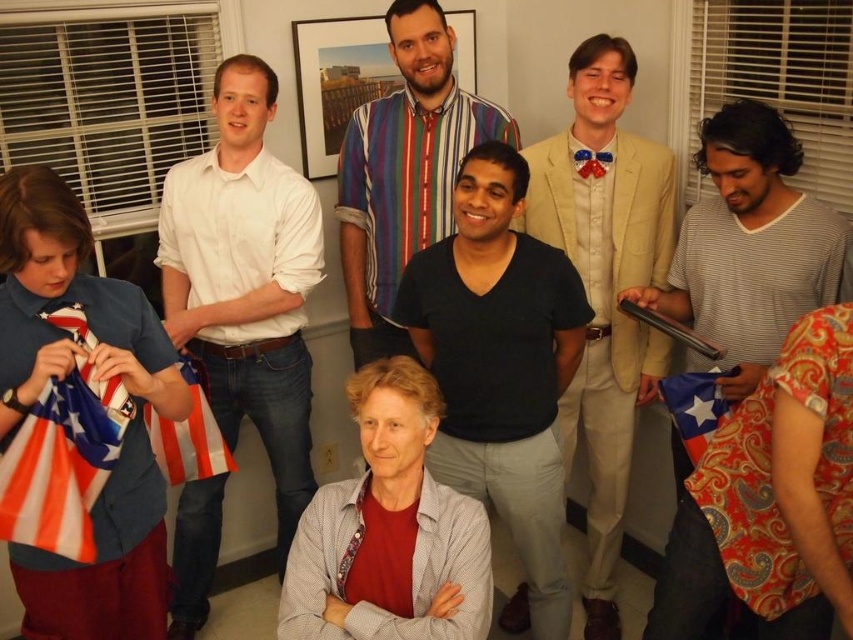
You are standing in the room and see the point at coordinates (389, 531). Which object is this point located on?

The point at coordinates (389, 531) is located on the gray textured sweater at center.

You are planning to hang a decorative item that is the same size as the gray textured sweater at center on a wall that can only accommodate items up to the size of the american flag at left. Will the sweater fit?

The gray textured sweater at center is wider than the american flag at left, so it will not fit on the wall that can only accommodate items up to the size of the american flag at left.

You are taking a photo of two points in the room. The first point is at coordinate point [395,404] and the second is at point [381,243]. Which point will appear larger in your photo?

Point [395,404] is closer to the camera than point [381,243], so it will appear larger in the photo.